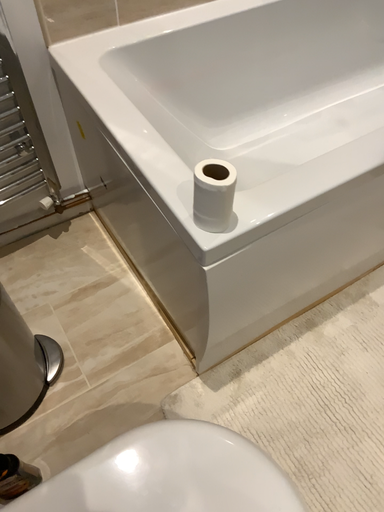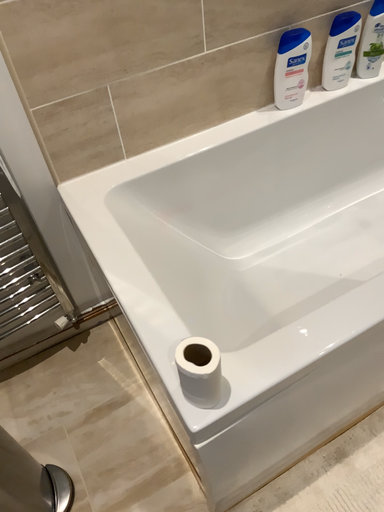
Question: How did the camera likely rotate when shooting the video?

Choices:
 (A) rotated downward
 (B) rotated upward

Answer: (B)